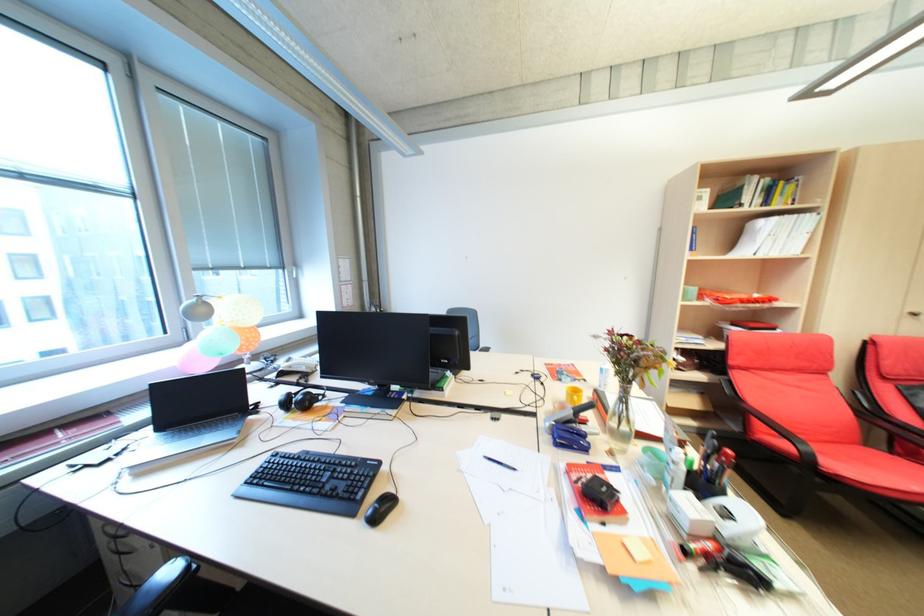
In order to click on white binder in this screenshot , I will do `click(786, 235)`.